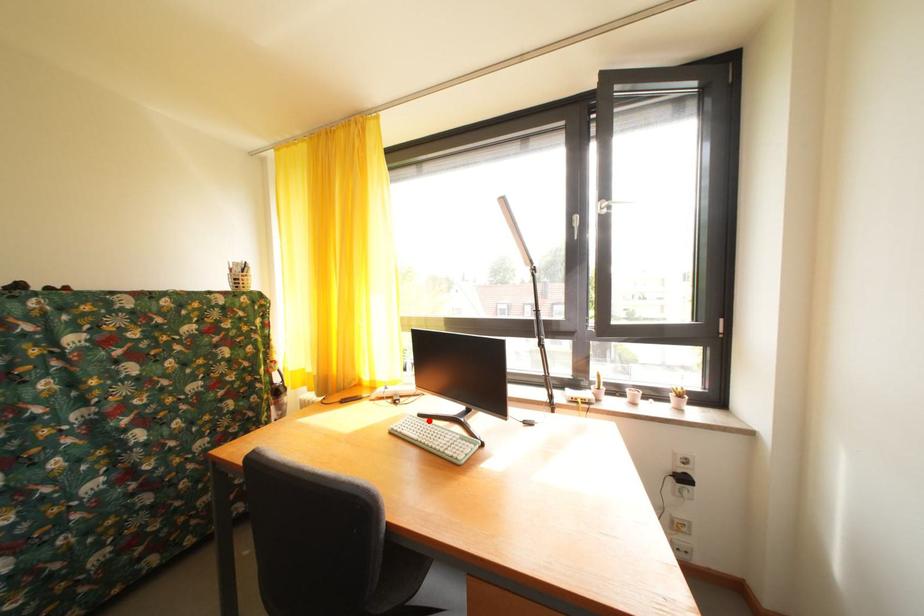
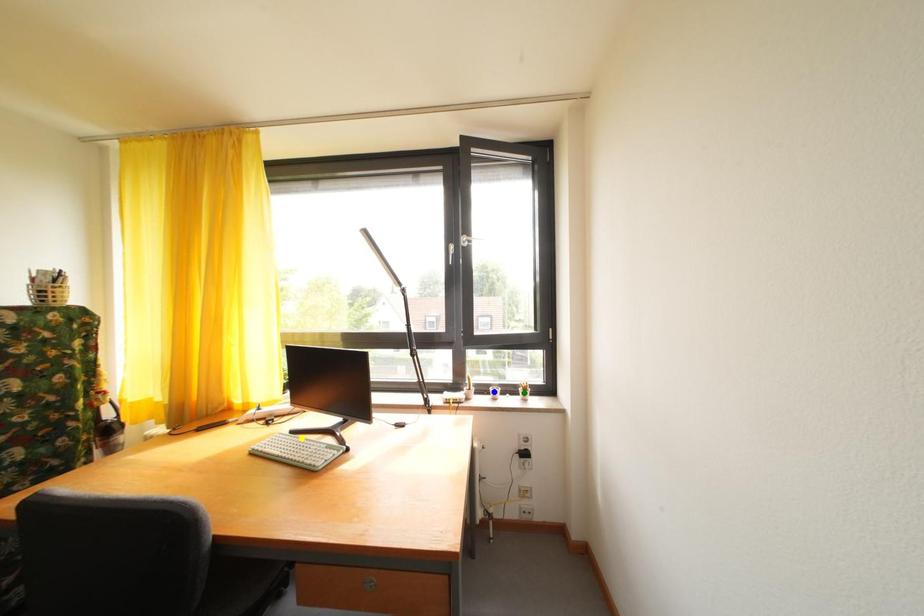
Question: I am providing you with two images of the same scene from different viewpoints. A red point is marked on the first image. You are given multiple points on the second image. Which point in image 2 represents the same 3d spot as the red point in image 1?

Choices:
 (A) green point
 (B) blue point
 (C) yellow point

Answer: (C)